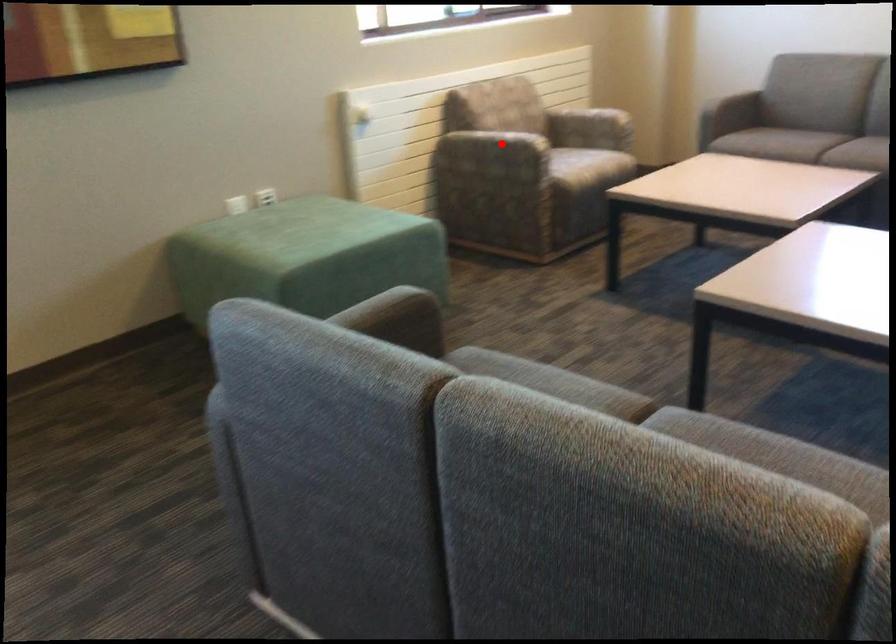
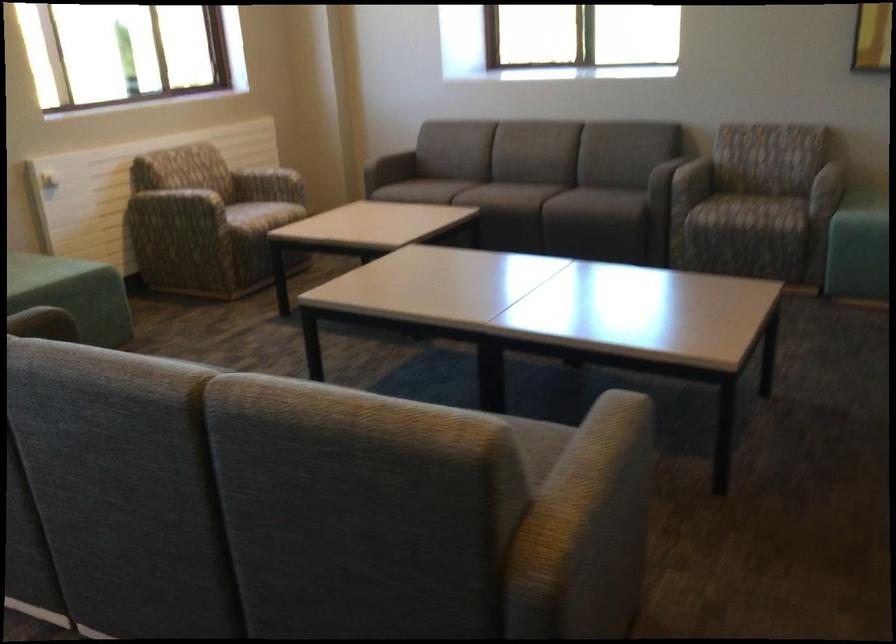
Question: A red point is marked in image1. In image2, is the corresponding 3D point closer to the camera or farther? Reply with the corresponding letter.

Choices:
 (A) The corresponding 3D point is closer.
 (B) The corresponding 3D point is farther.

Answer: (B)